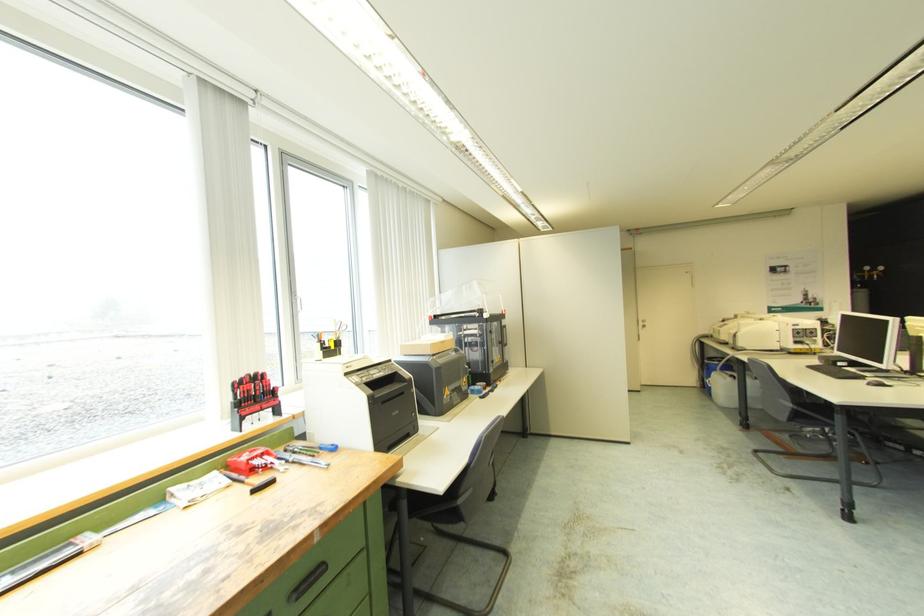
Find the location of `red plastic tool case`. red plastic tool case is located at coordinates (252, 461).